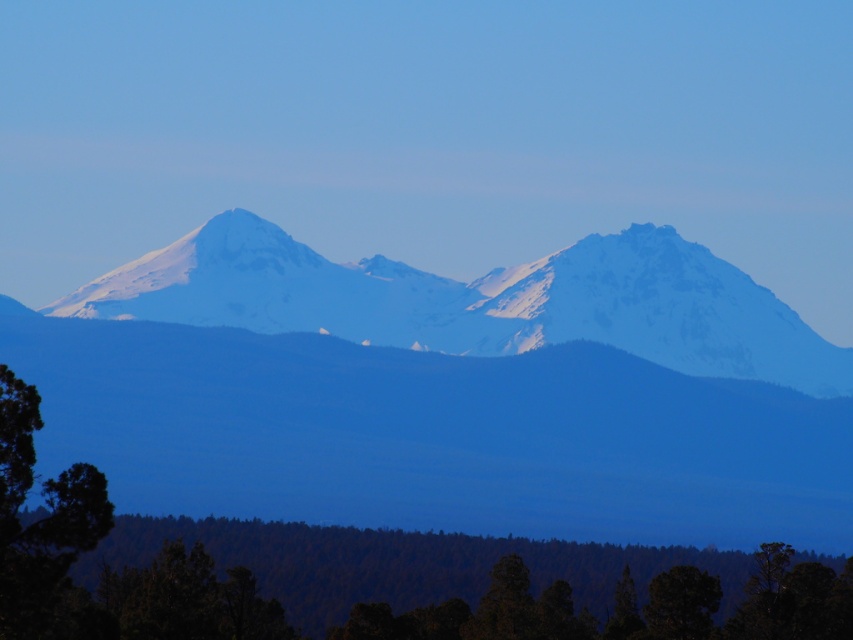
Does white snow-covered mountain range at center have a greater height compared to green leafy tree at lower left?

Correct, white snow-covered mountain range at center is much taller as green leafy tree at lower left.

Locate an element on the screen. white snow-covered mountain range at center is located at coordinates (410, 413).

Does white snow-covered mountain range at center have a larger size compared to green matte tree at lower center?

Yes.

What do you see at coordinates (410, 413) in the screenshot? I see `white snow-covered mountain range at center` at bounding box center [410, 413].

Where is `white snow-covered mountain range at center`? Image resolution: width=853 pixels, height=640 pixels. white snow-covered mountain range at center is located at coordinates (410, 413).

Can you confirm if green leafy tree at lower left is wider than green matte tree at lower center?

Yes.

Is point (51, 548) closer to camera compared to point (717, 604)?

Yes, point (51, 548) is in front of point (717, 604).

Does point (39, 417) come farther from viewer compared to point (670, 604)?

No.

The width and height of the screenshot is (853, 640). I want to click on green leafy tree at lower left, so click(x=45, y=531).